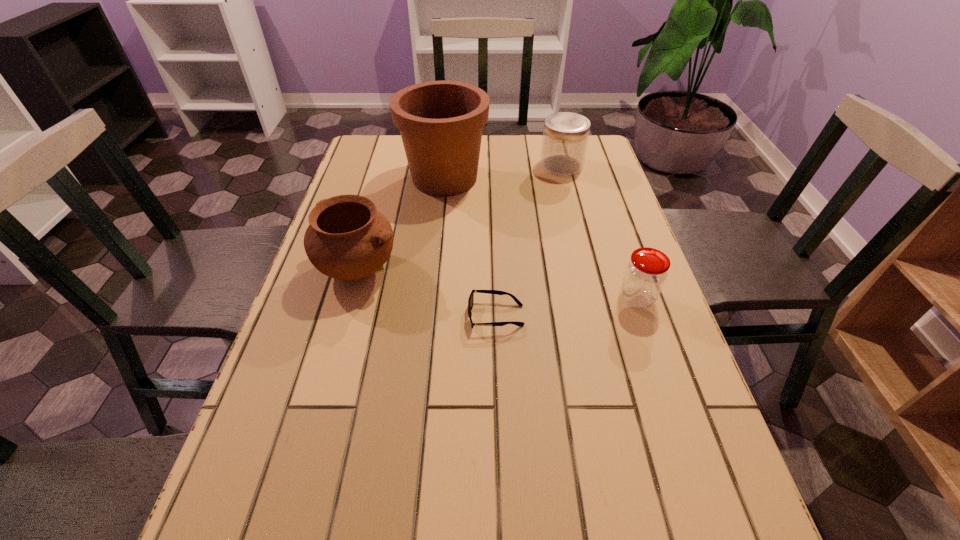
Where is `free space between the flowerpot and the fourth tallest object`? Image resolution: width=960 pixels, height=540 pixels. free space between the flowerpot and the fourth tallest object is located at coordinates (540, 239).

Where is `blank region between the flowerpot and the shortest object`? Image resolution: width=960 pixels, height=540 pixels. blank region between the flowerpot and the shortest object is located at coordinates (470, 247).

You are a GUI agent. You are given a task and a screenshot of the screen. Output one action in this format:
    pyautogui.click(x=<x>, y=<y>)
    Task: Click on the third closest object relative to the sunglasses
    The image size is (960, 540).
    Given the screenshot: What is the action you would take?
    pyautogui.click(x=441, y=122)

Identify which object is the third nearest to the sunglasses. Please provide its 2D coordinates. Your answer should be formatted as a tuple, i.e. [(x, y)], where the tuple contains the x and y coordinates of a point satisfying the conditions above.

[(441, 122)]